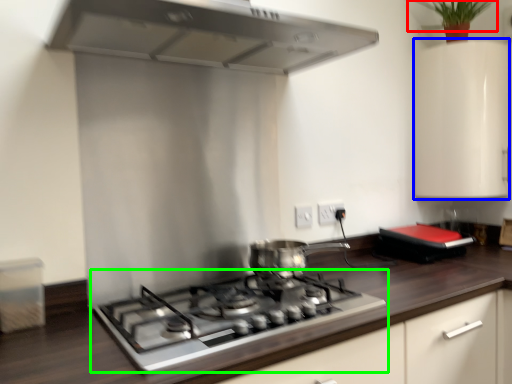
Question: Which object is positioned farthest from plant (highlighted by a red box)? Select from cabinetry (highlighted by a blue box) and gas stove (highlighted by a green box).

Choices:
 (A) cabinetry
 (B) gas stove

Answer: (B)